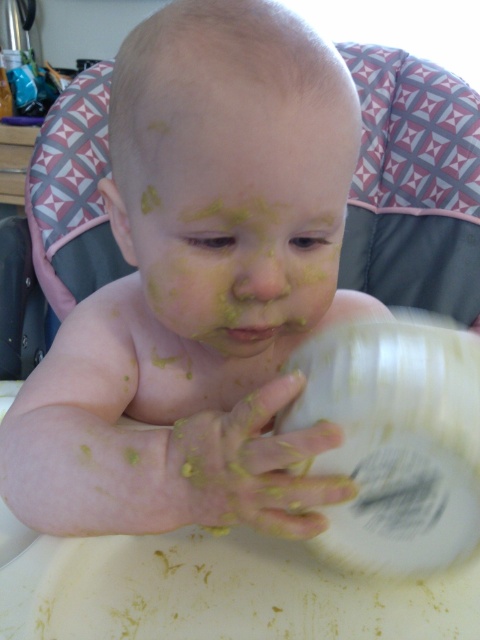
You are a caregiver trying to clean the baby. You see the yellowish paste at center and the yellow matte face at center. Which one is closer to you?

The yellow matte face at center is closer to you because it is in front of the yellowish paste at center.

You are a photographer taking a picture of the yellow matte baby at center. If your camera has a minimum focusing distance of 12 inches, will you be able to take a clear photo of the baby?

The yellow matte baby at center is 11.84 inches away from the camera, which is closer than the minimum focusing distance of 12 inches. Therefore, the camera will not be able to focus clearly on the baby.

From the picture: You are a caregiver who needs to clean the baby. The baby has a yellow matte face at center and yellowish paste at center. Which one is closer to the bowl on the tray?

The yellowish paste at center is closer to the bowl on the tray since it is only 4.55 inches away from the yellow matte face at center, but the exact distance to the bowl isn